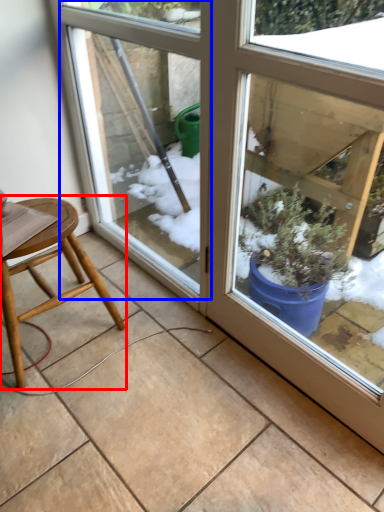
Question: Which of the following is the farthest to the observer, stool (highlighted by a red box) or screen door (highlighted by a blue box)?

Choices:
 (A) stool
 (B) screen door

Answer: (A)